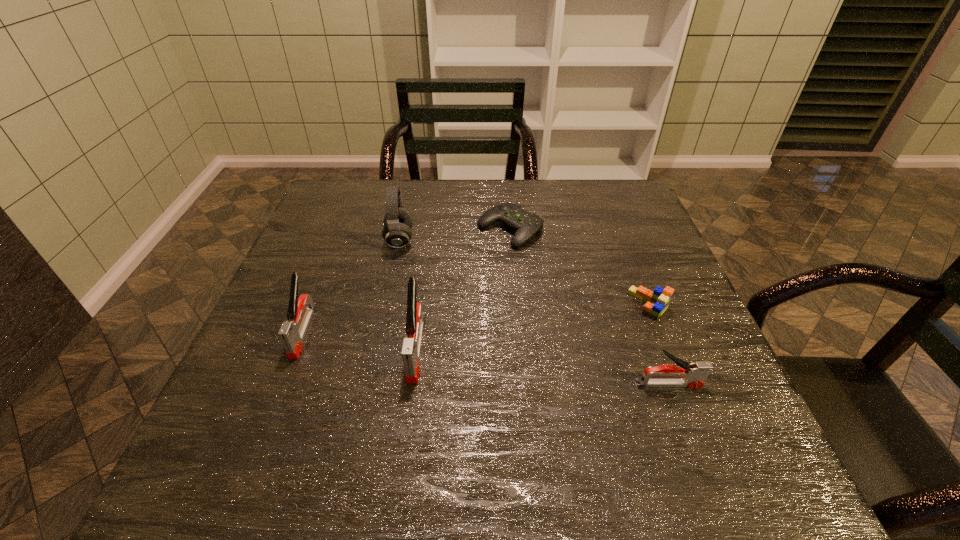
You are a GUI agent. You are given a task and a screenshot of the screen. Output one action in this format:
    pyautogui.click(x=<x>, y=<y>)
    Task: Click on the vacant space at the left edge of the desktop
    Image resolution: width=960 pixels, height=540 pixels.
    Given the screenshot: What is the action you would take?
    pyautogui.click(x=260, y=320)

In the image, there is a desktop. Identify the location of vacant space at the right edge. The width and height of the screenshot is (960, 540). (726, 373).

Find the location of a particular element. The height and width of the screenshot is (540, 960). vacant space at the far left corner of the desktop is located at coordinates (365, 180).

Where is `free location at the far right corner`? free location at the far right corner is located at coordinates (625, 206).

Identify the location of vacant area that lies between the control and the second stapler from left to right. (463, 289).

At what (x,y) coordinates should I click in order to perform the action: click on free space between the fourth object from right to left and the shortest stapler. Please return your answer as a coordinate pair (x, y). This screenshot has height=540, width=960. Looking at the image, I should click on 542,366.

Locate an element on the screen. This screenshot has height=540, width=960. empty space between the Lego and the shortest stapler is located at coordinates (659, 345).

The width and height of the screenshot is (960, 540). In order to click on free space that is in between the fifth tallest object and the third object from left to right in this screenshot , I will do `click(533, 326)`.

The image size is (960, 540). In order to click on free space between the fifth tallest object and the shortest object in this screenshot , I will do `click(580, 267)`.

I want to click on empty location between the control and the second stapler from right to left, so click(463, 289).